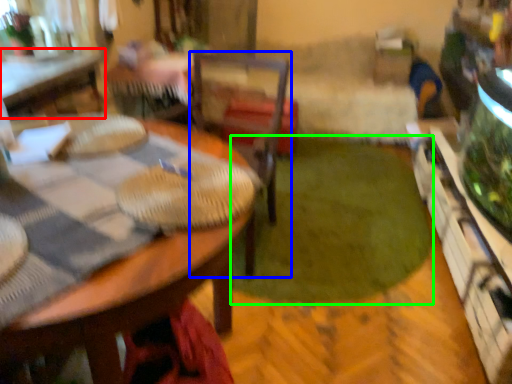
Question: Estimate the real-world distances between objects in this image. Which object is closer to table (highlighted by a red box), chair (highlighted by a blue box) or grass (highlighted by a green box)?

Choices:
 (A) chair
 (B) grass

Answer: (A)